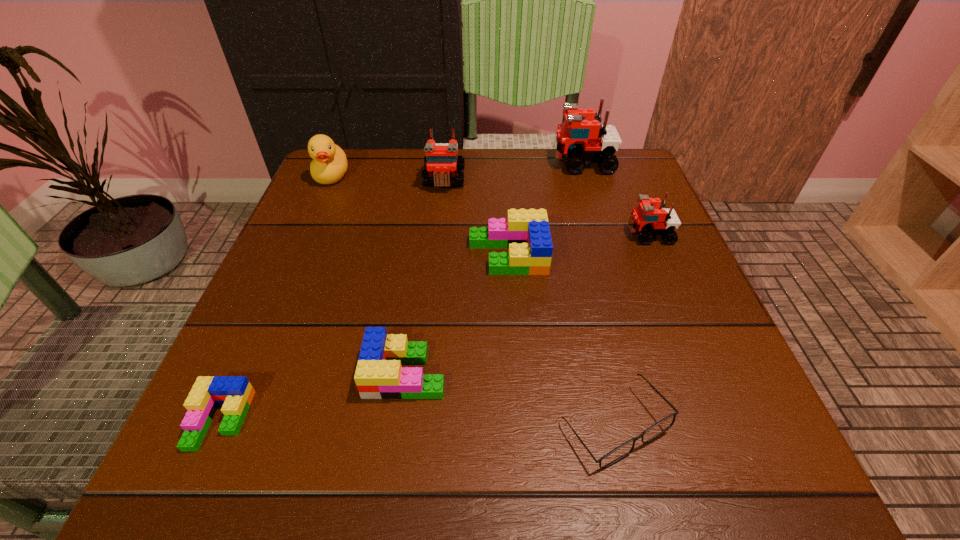
Image resolution: width=960 pixels, height=540 pixels. What are the coordinates of `vacant space at the far right corner` in the screenshot? It's located at (629, 172).

Image resolution: width=960 pixels, height=540 pixels. I want to click on unoccupied area between the spectacles and the smallest green Lego, so click(x=418, y=422).

Where is `vacant region between the second biggest green Lego and the spectacles`? Image resolution: width=960 pixels, height=540 pixels. vacant region between the second biggest green Lego and the spectacles is located at coordinates (510, 399).

Find the location of a particular element. Image resolution: width=960 pixels, height=540 pixels. vacant space that's between the smallest green Lego and the spectacles is located at coordinates (418, 422).

At what (x,y) coordinates should I click in order to perform the action: click on free space that is in between the third shortest Lego and the smallest red Lego. Please return your answer as a coordinate pair (x, y). The width and height of the screenshot is (960, 540). Looking at the image, I should click on (578, 245).

Locate an element on the screen. This screenshot has height=540, width=960. unoccupied position between the shortest Lego and the duck is located at coordinates (276, 298).

Identify the location of vacant space that's between the smallest red Lego and the second tallest Lego. The image size is (960, 540). (546, 207).

Locate which object is the third closest to the shortest Lego. Please provide its 2D coordinates. Your answer should be formatted as a tuple, i.e. [(x, y)], where the tuple contains the x and y coordinates of a point satisfying the conditions above.

[(620, 452)]

Where is `object that is the third closest to the tallest object`? object that is the third closest to the tallest object is located at coordinates (526, 233).

Identify which Lego is the fourth nearest to the tallest Lego. Please provide its 2D coordinates. Your answer should be formatted as a tuple, i.e. [(x, y)], where the tuple contains the x and y coordinates of a point satisfying the conditions above.

[(379, 375)]